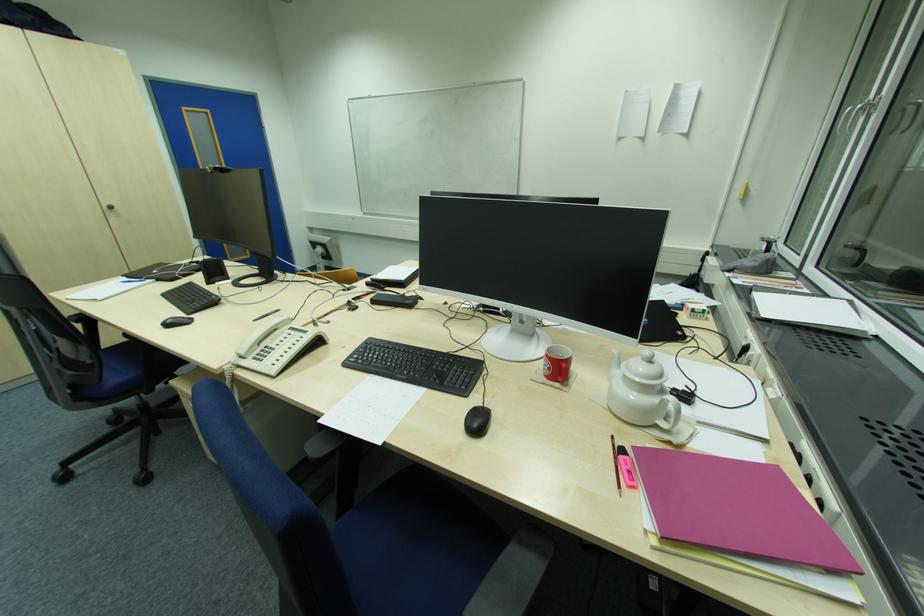
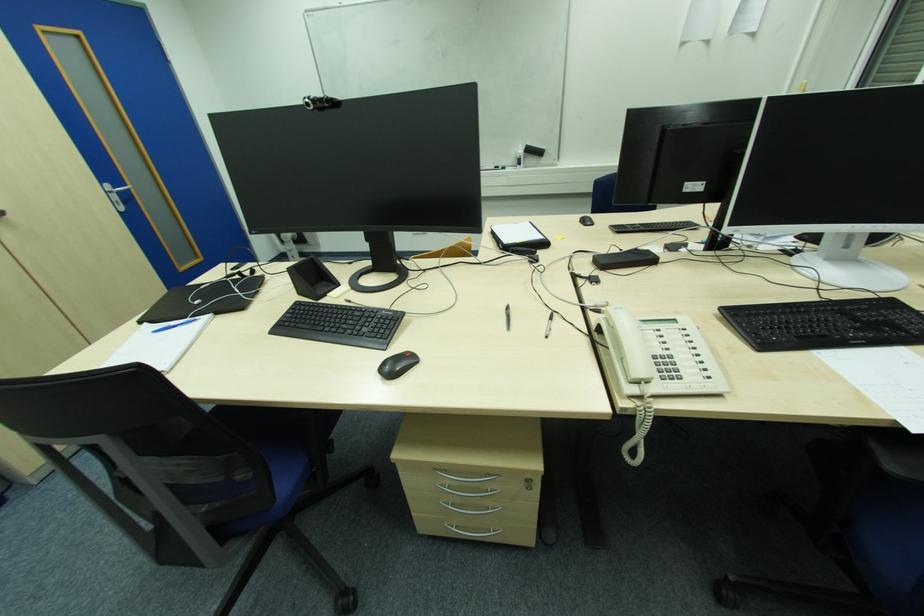
Locate, in the second image, the point that corresponds to (x=172, y=323) in the first image.

(388, 369)